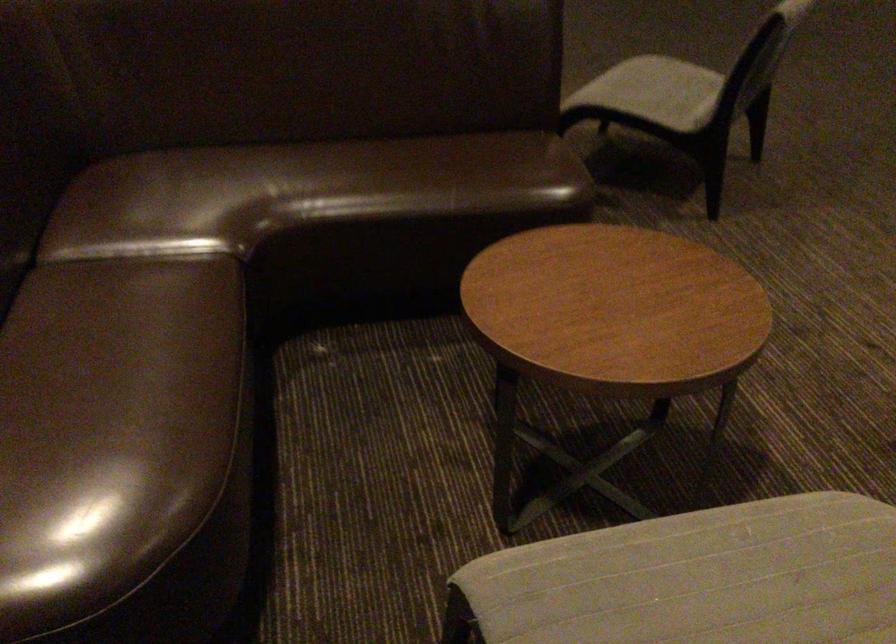
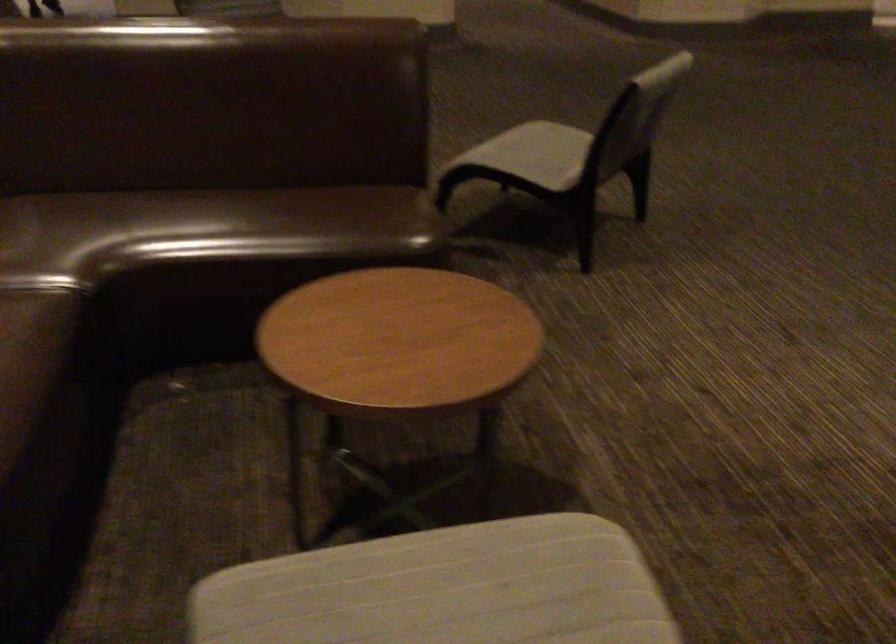
In the second image, find the point that corresponds to (655,86) in the first image.

(533, 154)